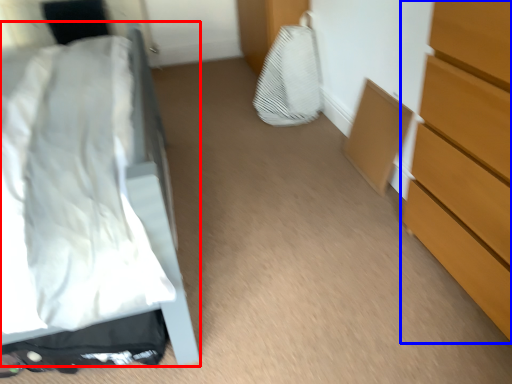
Question: Which of the following is the farthest to the observer, bed (highlighted by a red box) or chest of drawers (highlighted by a blue box)?

Choices:
 (A) bed
 (B) chest of drawers

Answer: (B)